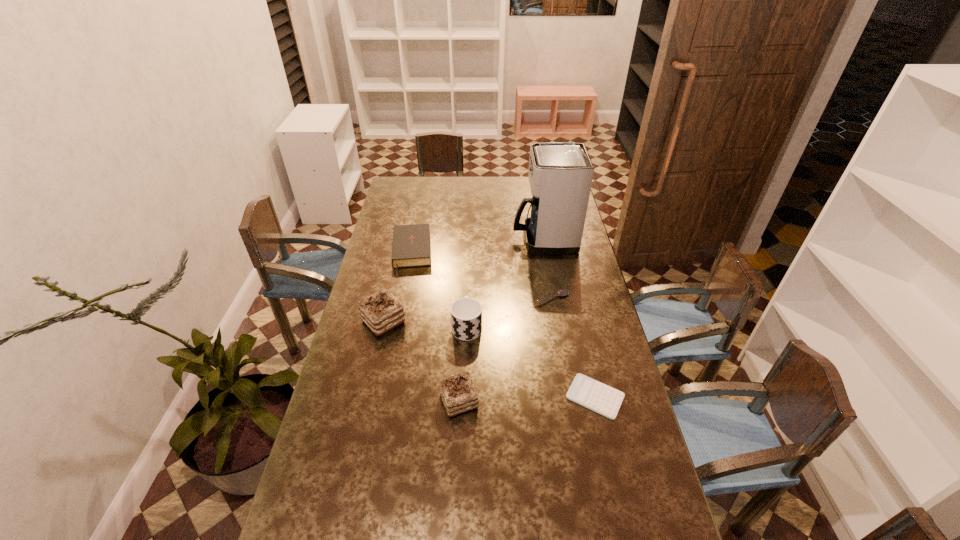
This screenshot has height=540, width=960. I want to click on free space between the calculator and the farther chocolate cake, so click(x=490, y=359).

The height and width of the screenshot is (540, 960). What are the coordinates of `empty space that is in between the calculator and the cup` in the screenshot? It's located at (531, 361).

Locate an element on the screen. Image resolution: width=960 pixels, height=540 pixels. free point between the right chocolate cake and the Bible is located at coordinates (435, 327).

You are a GUI agent. You are given a task and a screenshot of the screen. Output one action in this format:
    pyautogui.click(x=<x>, y=<y>)
    Task: Click on the vacant area that lies between the cup and the left chocolate cake
    The height and width of the screenshot is (540, 960).
    Given the screenshot: What is the action you would take?
    pyautogui.click(x=425, y=323)

Locate an element on the screen. This screenshot has height=540, width=960. empty space that is in between the nearer chocolate cake and the third shortest object is located at coordinates (435, 327).

Where is `free space between the farther chocolate cake and the cup`? The image size is (960, 540). free space between the farther chocolate cake and the cup is located at coordinates (425, 323).

The image size is (960, 540). Find the location of `vacant space that's between the calculator and the Bible`. vacant space that's between the calculator and the Bible is located at coordinates (503, 325).

Locate an element on the screen. This screenshot has width=960, height=540. object that is the fifth closest to the Bible is located at coordinates (458, 393).

Find the location of a particular element. This screenshot has height=540, width=960. the third closest object relative to the soupspoon is located at coordinates (594, 395).

This screenshot has width=960, height=540. Find the location of `vacant space that satisfies the following two spatial constraints: 1. on the side of the cup with the handle; 2. on the right side of the soupspoon`. vacant space that satisfies the following two spatial constraints: 1. on the side of the cup with the handle; 2. on the right side of the soupspoon is located at coordinates (468, 298).